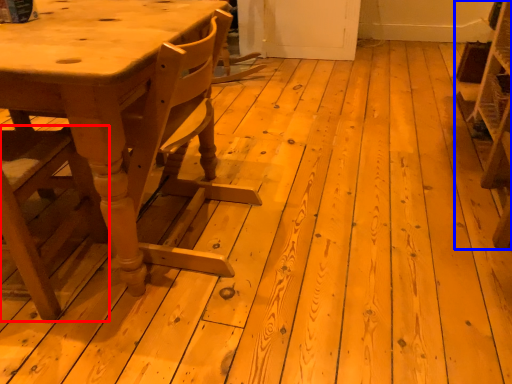
Question: Among these objects, which one is farthest to the camera, chair (highlighted by a red box) or shelf (highlighted by a blue box)?

Choices:
 (A) chair
 (B) shelf

Answer: (B)